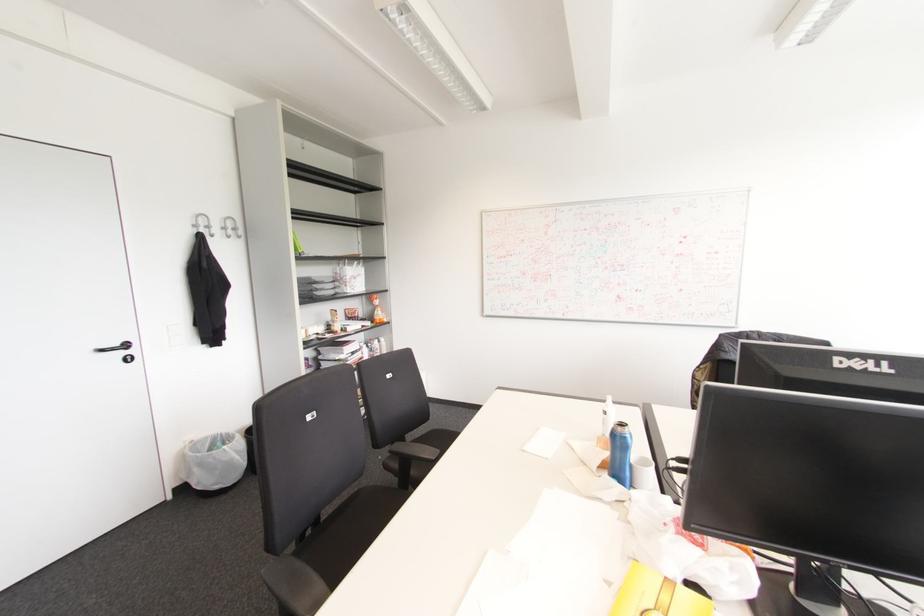
Which object does [608,416] point to?

It refers to a white pump bottle.